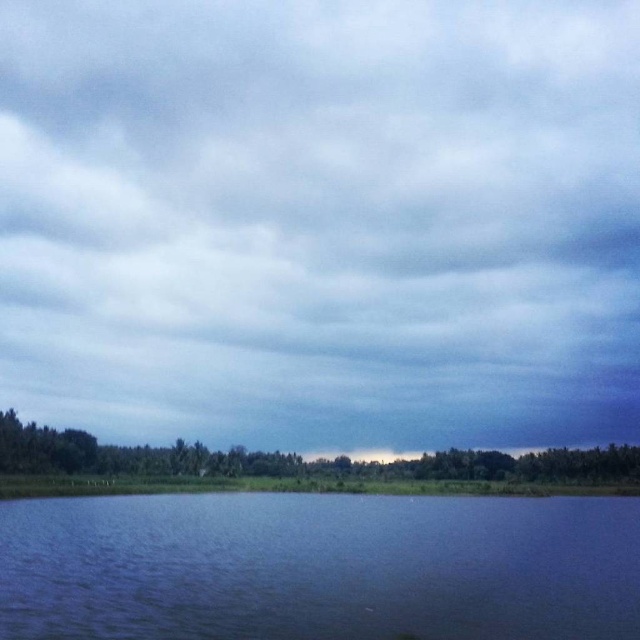
Based on the photo, which of these two, blue liquid water at bottom or green leafy trees at lower left, stands taller?

Standing taller between the two is green leafy trees at lower left.

Find the location of `blue liquid water at bottom`. blue liquid water at bottom is located at coordinates (317, 566).

Where is `blue liquid water at bottom`? This screenshot has height=640, width=640. blue liquid water at bottom is located at coordinates (317, 566).

Who is shorter, cloudy sky at upper center or blue liquid water at bottom?

Standing shorter between the two is blue liquid water at bottom.

Does cloudy sky at upper center appear on the right side of blue liquid water at bottom?

No, cloudy sky at upper center is not to the right of blue liquid water at bottom.

I want to click on cloudy sky at upper center, so click(321, 220).

Is cloudy sky at upper center taller than green leafy trees at lower left?

Correct, cloudy sky at upper center is much taller as green leafy trees at lower left.

Is cloudy sky at upper center further to the viewer compared to green leafy trees at lower left?

Yes.

What do you see at coordinates (321, 220) in the screenshot? Image resolution: width=640 pixels, height=640 pixels. I see `cloudy sky at upper center` at bounding box center [321, 220].

Identify the location of cloudy sky at upper center. Image resolution: width=640 pixels, height=640 pixels. (321, 220).